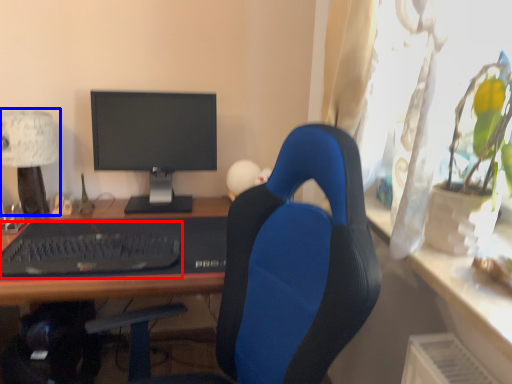
Question: Which object appears farthest to the camera in this image, laptop keyboard (highlighted by a red box) or table lamp (highlighted by a blue box)?

Choices:
 (A) laptop keyboard
 (B) table lamp

Answer: (B)